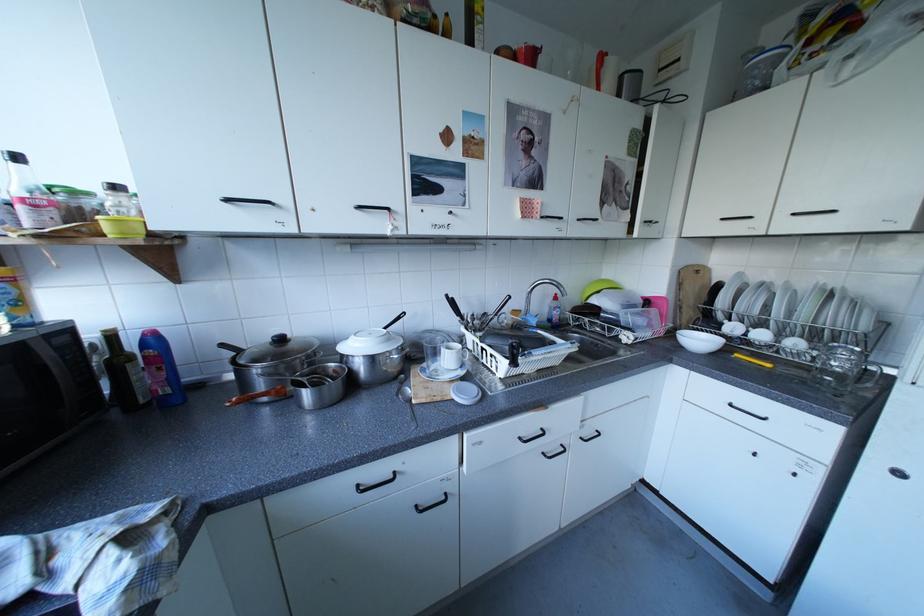
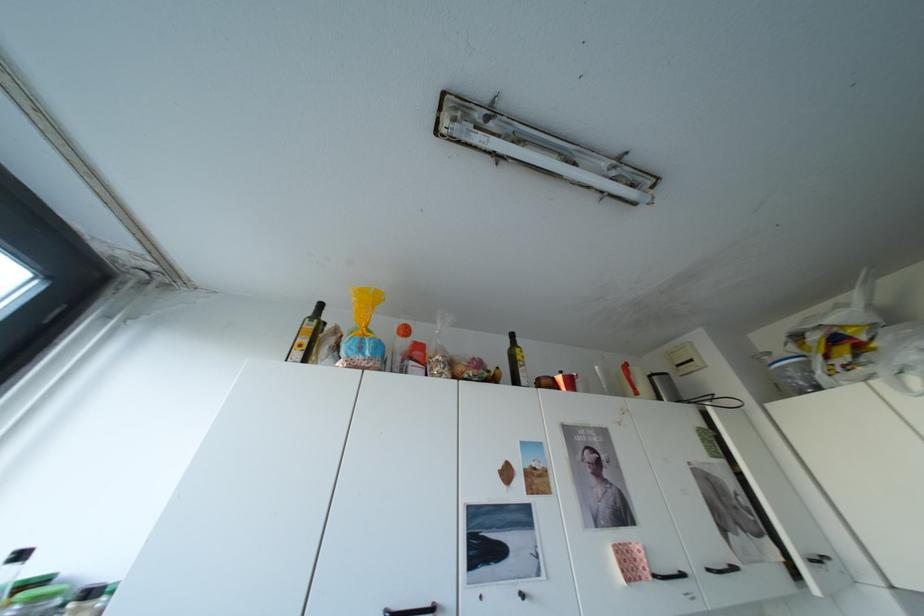
Find the pixel in the second image that matches (x=821, y=43) in the first image.

(840, 357)